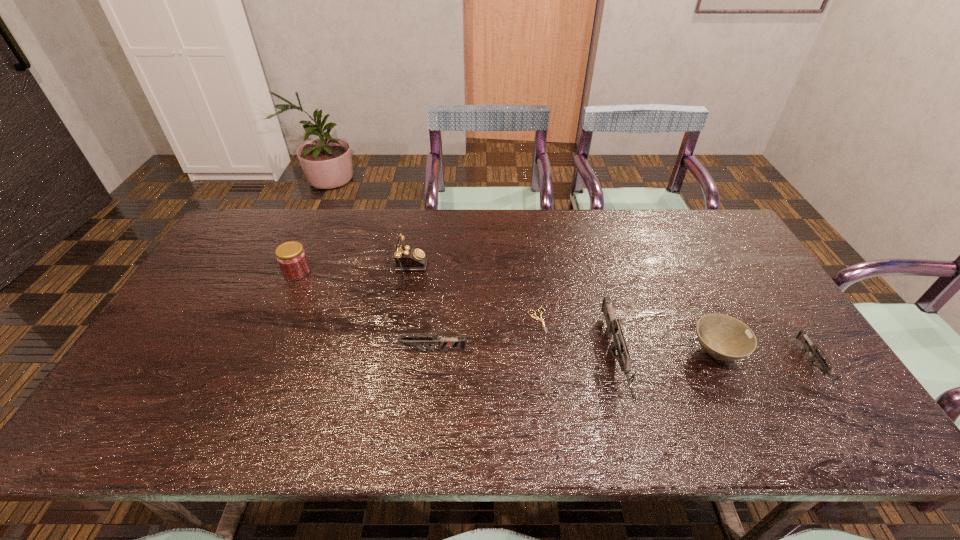
Find the location of a particular element. Image resolution: width=960 pixels, height=540 pixels. the leftmost gun is located at coordinates (445, 342).

The height and width of the screenshot is (540, 960). What are the coordinates of `the tallest gun` in the screenshot? It's located at (613, 328).

Locate an element on the screen. the second gun from right to left is located at coordinates (613, 328).

Locate an element on the screen. Image resolution: width=960 pixels, height=540 pixels. the rightmost gun is located at coordinates (802, 336).

This screenshot has width=960, height=540. I want to click on the shortest gun, so click(802, 336).

Identify the location of the leftmost object. (291, 257).

Where is `the shortest object`? the shortest object is located at coordinates (536, 317).

Where is `the fourth object from left to right`? This screenshot has height=540, width=960. the fourth object from left to right is located at coordinates (536, 317).

Locate an element on the screen. telephone is located at coordinates (407, 258).

What are the coordinates of `the sixth object from left to right` in the screenshot? It's located at (723, 337).